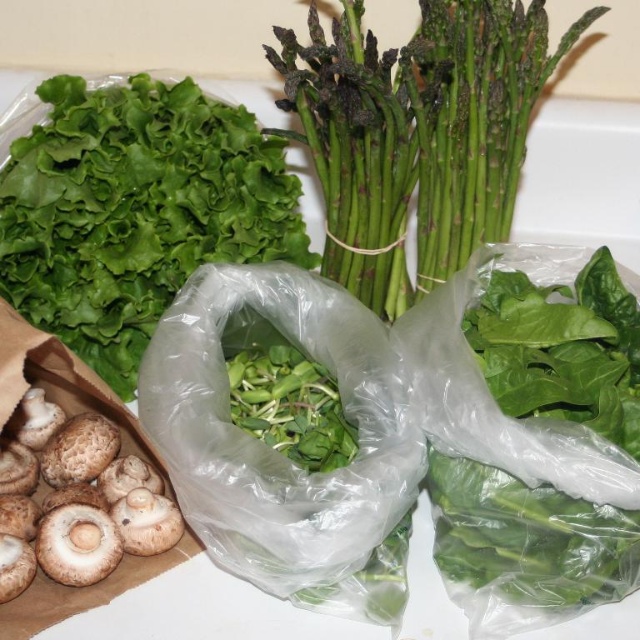
Can you confirm if green matte asparagus at center is smaller than brown textured mushroom at lower left?

Incorrect, green matte asparagus at center is not smaller in size than brown textured mushroom at lower left.

Is green matte asparagus at center bigger than brown textured mushroom at lower left?

Yes.

This screenshot has height=640, width=640. Describe the element at coordinates (417, 132) in the screenshot. I see `green matte asparagus at center` at that location.

This screenshot has width=640, height=640. In order to click on green matte asparagus at center in this screenshot , I will do `click(417, 132)`.

Is green leafy lettuce at upper left bigger than green matte asparagus at center?

No, green leafy lettuce at upper left is not bigger than green matte asparagus at center.

Between point (218, 125) and point (454, 4), which one is positioned behind?

Positioned behind is point (218, 125).

Find the location of a particular element. The image size is (640, 640). green leafy lettuce at upper left is located at coordinates (134, 211).

Is green leafy lettuce at upper left shorter than brown textured mushroom at lower left?

No.

Between point (93, 278) and point (29, 513), which one is positioned behind?

The point (93, 278) is behind.

Where is `green leafy lettuce at upper left`? green leafy lettuce at upper left is located at coordinates (134, 211).